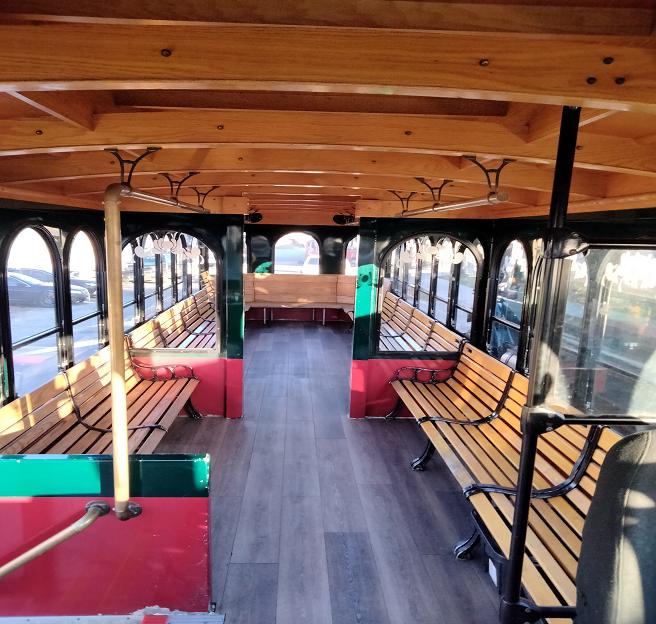
Where is `trolley divider`? trolley divider is located at coordinates (370, 371), (229, 364).